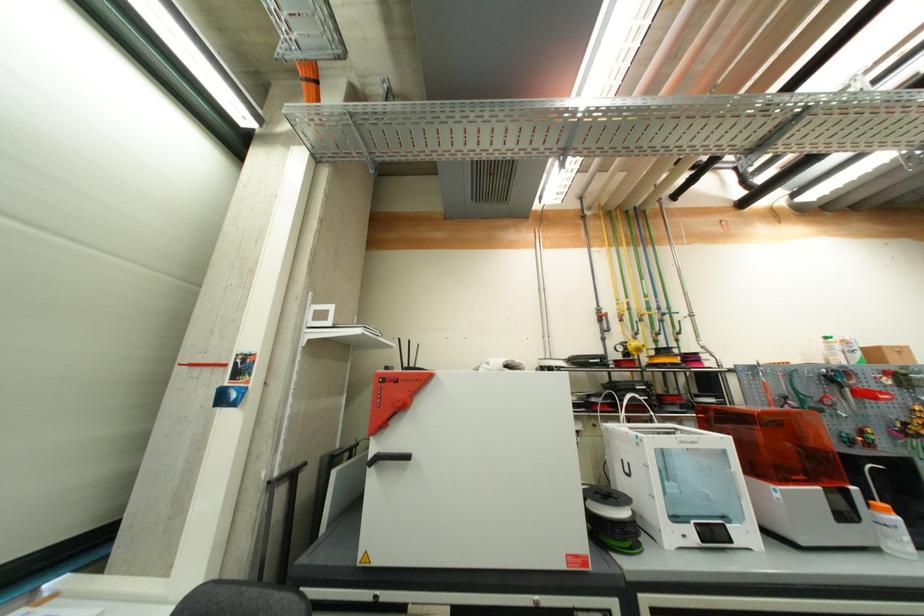
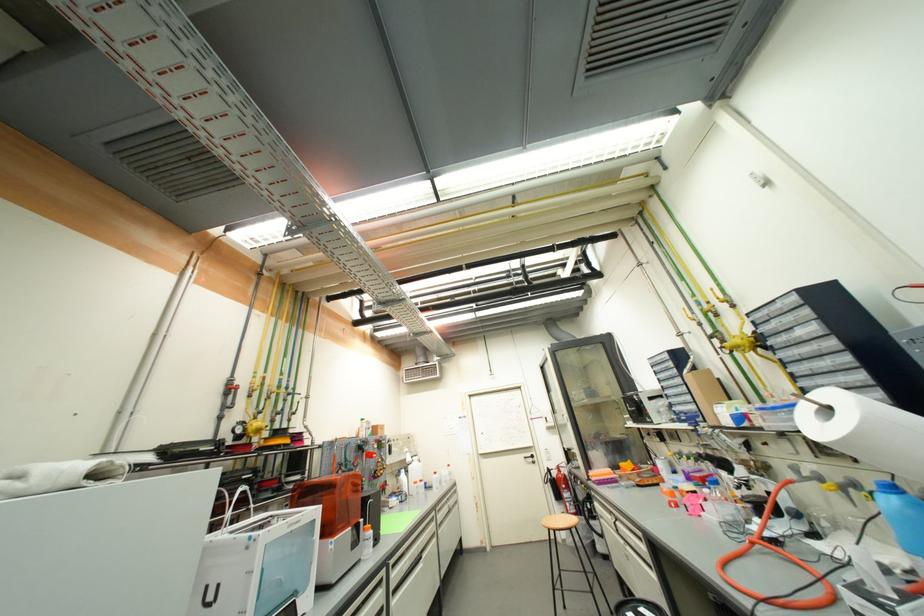
The first image is from the beginning of the video and the second image is from the end. How did the camera likely rotate when shooting the video?

The rotation direction of the camera is right-up.